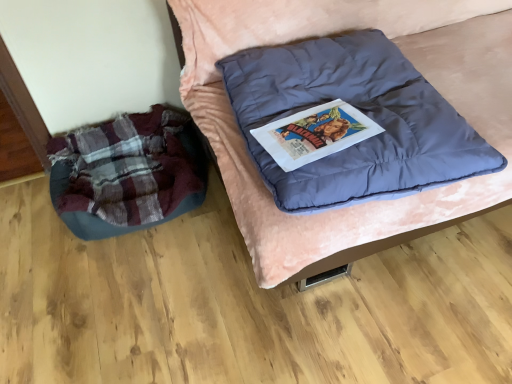
Question: Is point coord(70,150) positioned closer to the camera than point coord(185,89)?

Choices:
 (A) farther
 (B) closer

Answer: (A)

Question: From the image's perspective, is plaid fabric bean bag at left located above or below matte blue cushion at center?

Choices:
 (A) below
 (B) above

Answer: (A)

Question: In the image, is plaid fabric bean bag at left positioned in front of or behind matte blue cushion at center?

Choices:
 (A) behind
 (B) front

Answer: (A)

Question: In terms of height, does matte blue cushion at center look taller or shorter compared to plaid fabric bean bag at left?

Choices:
 (A) short
 (B) tall

Answer: (B)

Question: Considering their positions, is matte blue cushion at center located in front of or behind plaid fabric bean bag at left?

Choices:
 (A) front
 (B) behind

Answer: (A)

Question: From a real-world perspective, is matte blue cushion at center positioned above or below plaid fabric bean bag at left?

Choices:
 (A) above
 (B) below

Answer: (A)

Question: Looking at their shapes, would you say matte blue cushion at center is wider or thinner than plaid fabric bean bag at left?

Choices:
 (A) thin
 (B) wide

Answer: (B)